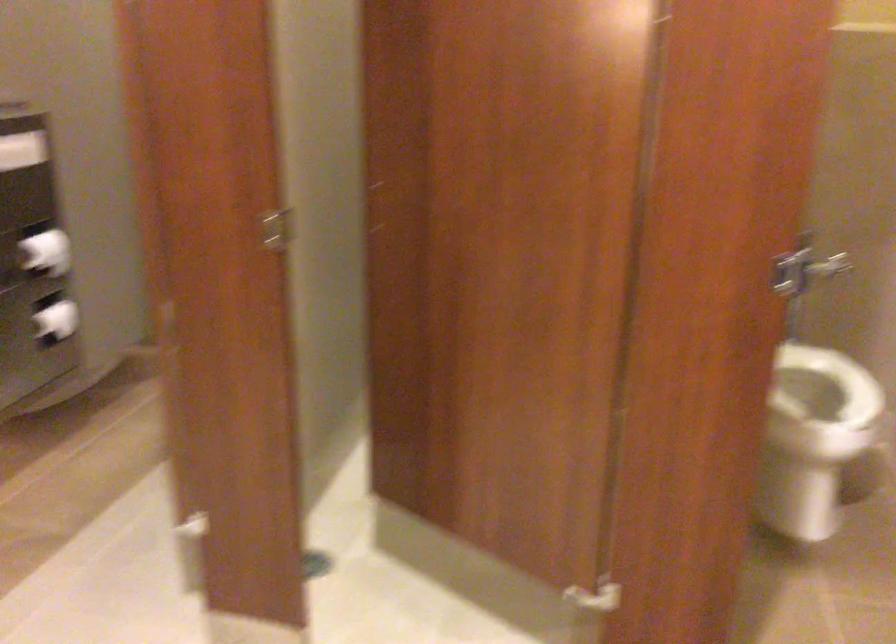
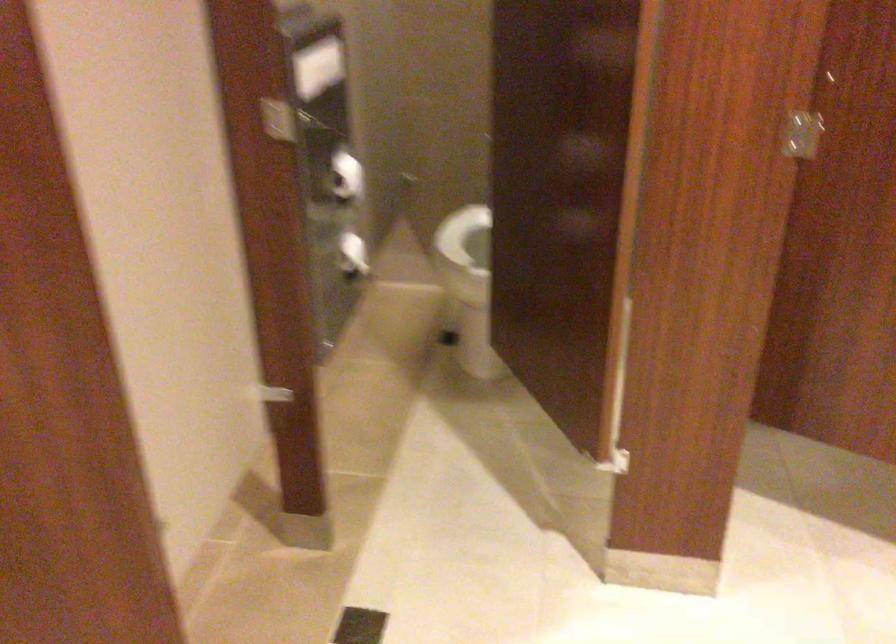
Question: How did the camera likely rotate?

Choices:
 (A) Left
 (B) Right
 (C) Up
 (D) Down

Answer: (D)